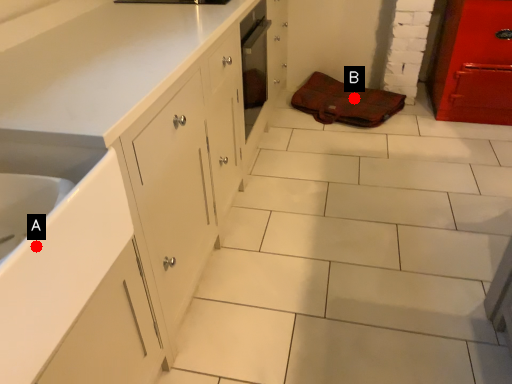
Question: Two points are circled on the image, labeled by A and B beside each circle. Which point is closer to the camera taking this photo?

Choices:
 (A) A is closer
 (B) B is closer

Answer: (A)